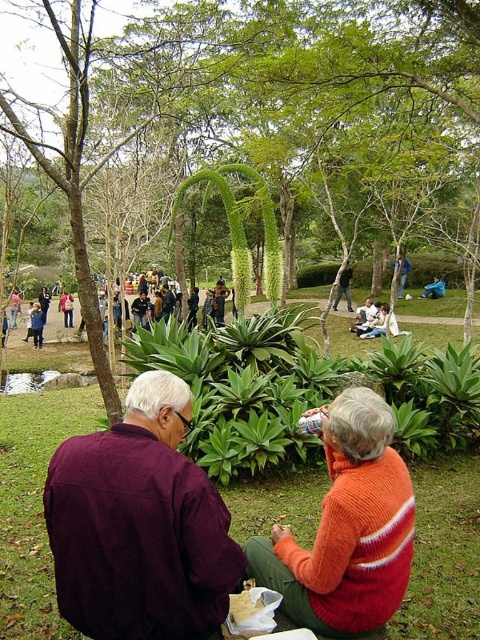
You are planning to place a new bench in the park scene. The bench requires a space that is wider than the blue fabric bag at center. Can the area near the green leafy tree at center accommodate the bench?

The green leafy tree at center might be wider than the blue fabric bag at center, so the area near the green leafy tree at center could potentially accommodate the bench if the tree provides sufficient width. However, the exact dimensions are uncertain based on the provided information.

You are planning to take a photo of the green leafy tree at center and the blue fabric bag at center. Which object should you focus on first if you want to capture both in a single frame without moving the camera?

You should focus on the green leafy tree at center first because it is taller than the blue fabric bag at center, ensuring it fits within the frame.

You are a gardener who needs to water the green leafy plants at center and the smooth brown wooden stick at center. Which object should you water first if you want to start from the lowest position?

The green leafy plants at center should be watered first because they are located below the smooth brown wooden stick at center.